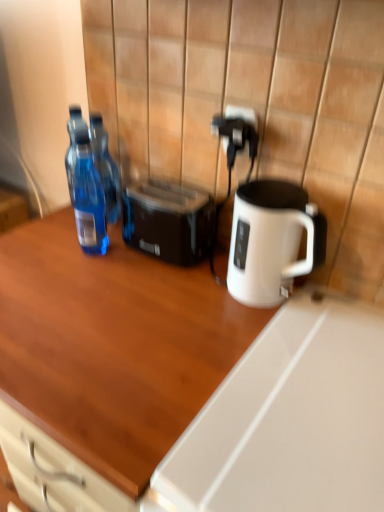
What are the coordinates of `free point above wooden desk at center (from a real-world perspective)` in the screenshot? It's located at (123, 306).